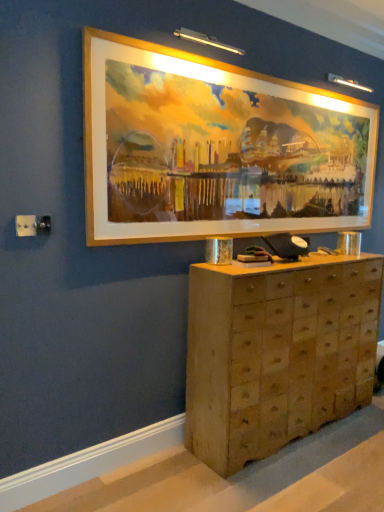
Image resolution: width=384 pixels, height=512 pixels. What are the coordinates of `free space above gold-framed painting at upper center (from a real-world perspective)` in the screenshot? It's located at (284, 80).